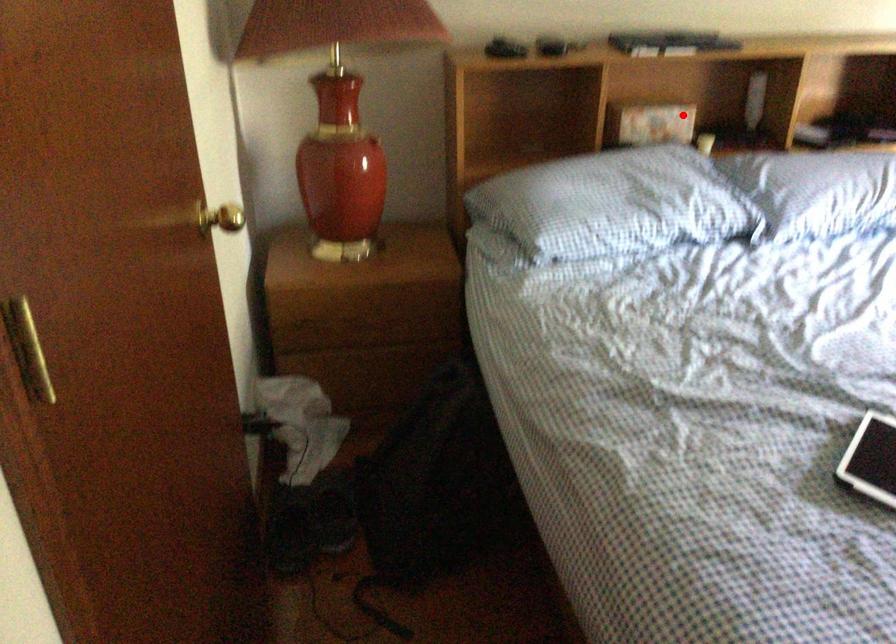
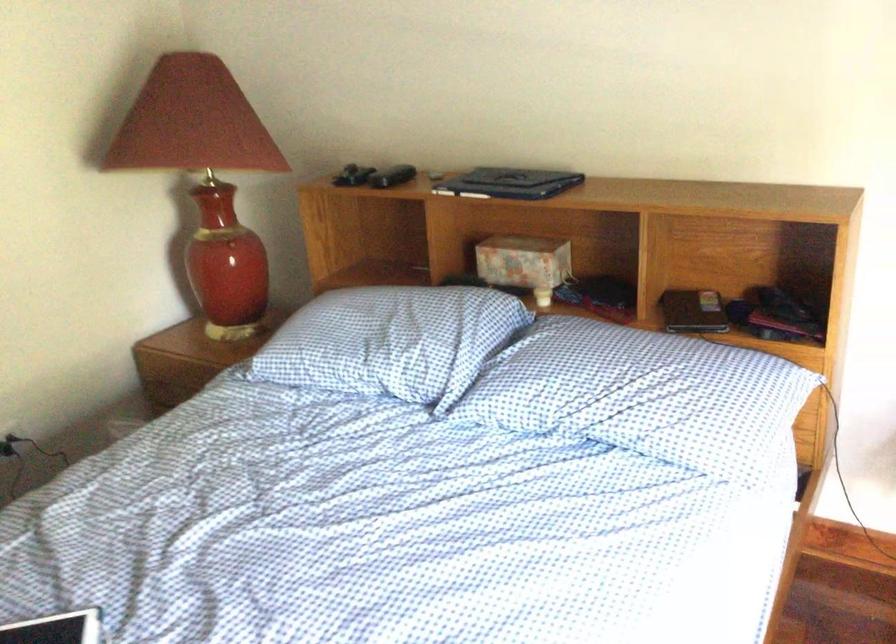
In the second image, find the point that corresponds to the highlighted location in the first image.

(524, 263)